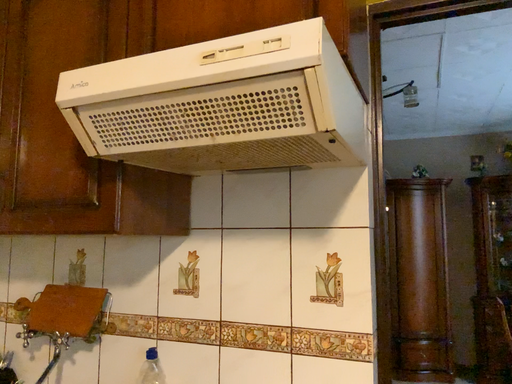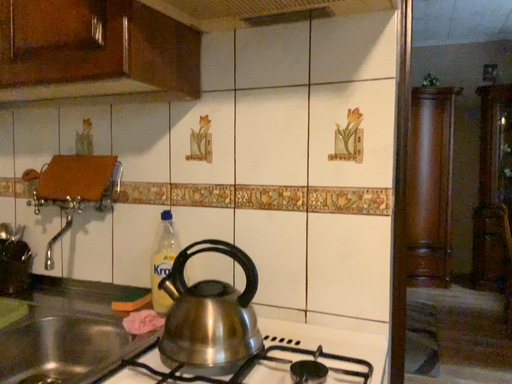
Question: How did the camera likely rotate when shooting the video?

Choices:
 (A) rotated downward
 (B) rotated upward

Answer: (A)